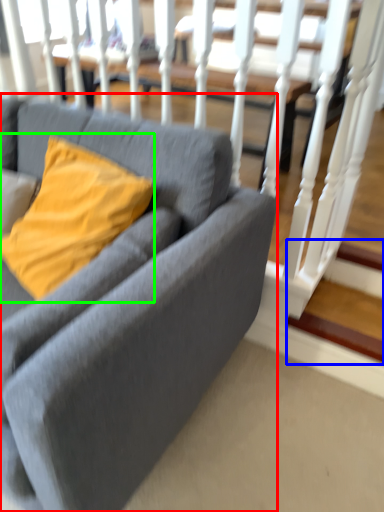
Question: Which is farther away from studio couch (highlighted by a red box)? stairwell (highlighted by a blue box) or pillow (highlighted by a green box)?

Choices:
 (A) stairwell
 (B) pillow

Answer: (A)